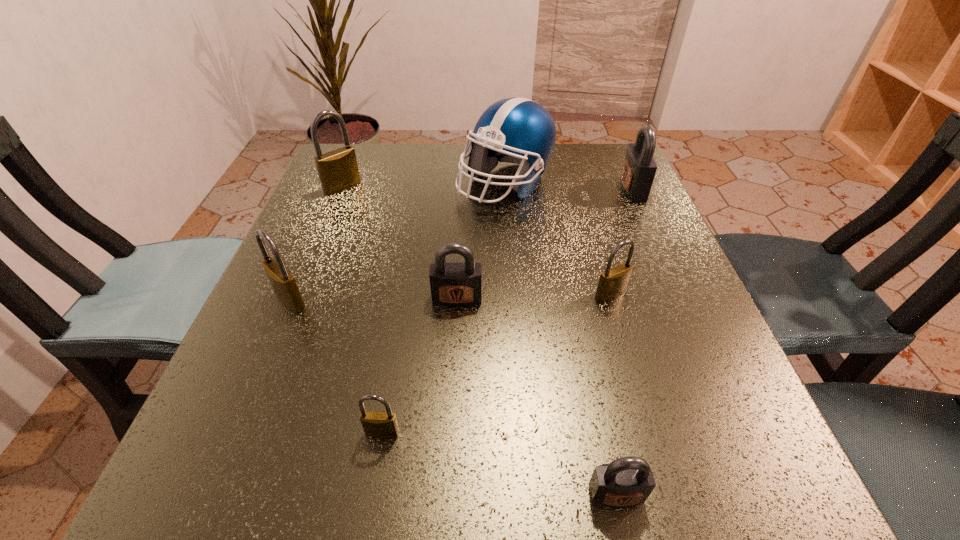
This screenshot has width=960, height=540. What are the coordinates of `free space between the second object from right to left and the second farthest gray padlock` in the screenshot? It's located at (534, 296).

The image size is (960, 540). I want to click on free spot between the third biggest brass padlock and the nearest brass padlock, so click(x=496, y=363).

Locate which object is the fifth closest to the farthest brass padlock. Please provide its 2D coordinates. Your answer should be formatted as a tuple, i.e. [(x, y)], where the tuple contains the x and y coordinates of a point satisfying the conditions above.

[(379, 424)]

Where is `object that is the fifth closest one to the smallest brass padlock`? object that is the fifth closest one to the smallest brass padlock is located at coordinates click(x=516, y=130).

Select which padlock is the sixth closest to the biggest brass padlock. Please provide its 2D coordinates. Your answer should be formatted as a tuple, i.e. [(x, y)], where the tuple contains the x and y coordinates of a point satisfying the conditions above.

[(627, 481)]

At what (x,y) coordinates should I click in order to perform the action: click on padlock that is the sixth closest to the third object from left to right. Please return your answer as a coordinate pair (x, y). Looking at the image, I should click on (639, 167).

Where is `brass padlock that is the second closest to the football helmet`? The width and height of the screenshot is (960, 540). brass padlock that is the second closest to the football helmet is located at coordinates (338, 171).

Identify the location of brass padlock that stands as the fourth closest to the blue football helmet. [379, 424].

Locate an element on the screen. This screenshot has height=540, width=960. gray padlock object that ranks as the closest to the leftmost gray padlock is located at coordinates (627, 481).

Locate an element on the screen. This screenshot has width=960, height=540. gray padlock that is the closest to the third object from left to right is located at coordinates (456, 284).